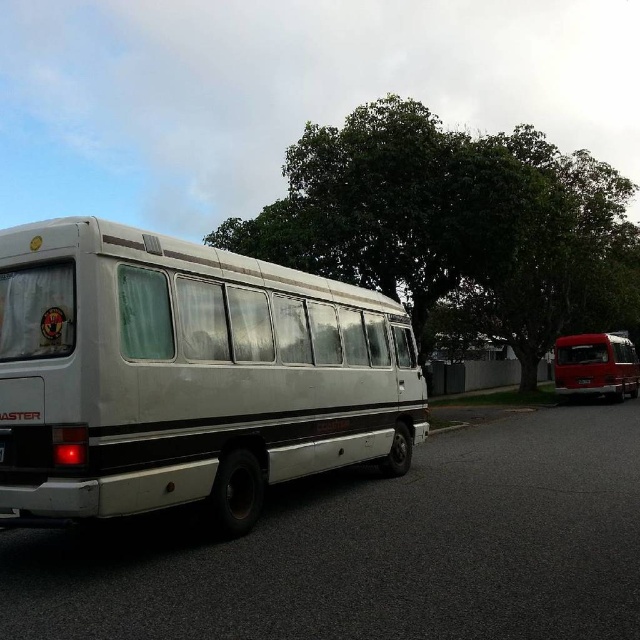
You are a pedestrian standing on the sidewalk and see the green leafy tree at center and the shiny red van at right. Which object is closer to the street?

The green leafy tree at center is positioned on the left side of the shiny red van at right, so the shiny red van at right is closer to the street.

You are standing on the sidewalk and want to cross the street to reach the white matte bus at center. The crosswalk is 5 meters away from you. Can you safely reach the bus before the crosswalk ends?

The white matte bus at center is 4.27 meters away from the viewer, which is less than the 5 meters distance to the crosswalk. Therefore, you can safely reach the bus before the crosswalk ends.